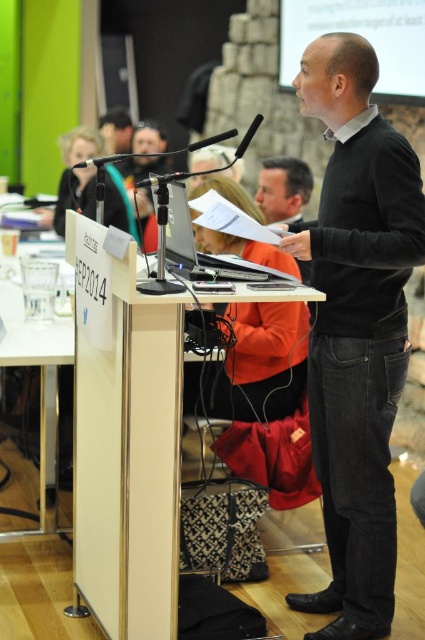
You are organizing a panel discussion and need to ensure that two speakers can use the microphones simultaneously. Based on the image, which microphone, the black matte microphone at left or the black plastic microphone at center, would allow for more comfortable simultaneous use due to its size?

The black matte microphone at left might be wider than black plastic microphone at center, so the black matte microphone at left would likely provide more comfortable simultaneous use as it has a larger size compared to the black plastic microphone at center.

You are an event organizer who needs to adjust the lighting to ensure both the black velvet sweater at center and the black matte microphone at left are clearly visible. Considering their heights, which one might require a spotlight with a higher angle to avoid shadows?

The black velvet sweater at center is much taller than the black matte microphone at left, so the spotlight for the black velvet sweater at center should be angled higher to avoid casting shadows.